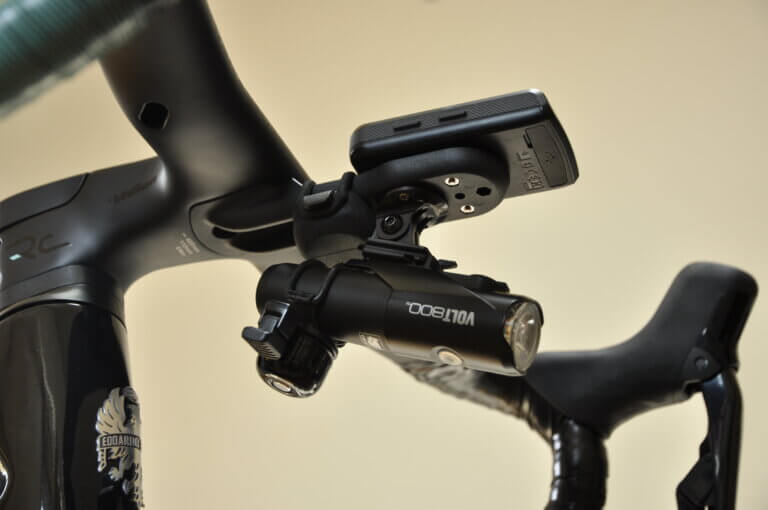
Find the location of `electronic device`. electronic device is located at coordinates (517, 139).